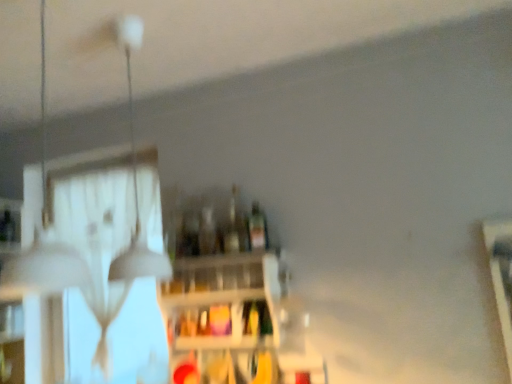
Question: In the image, is white matte lampshade at upper left, the first lamp viewed from the back, on the left side or the right side of translucent glass bottle at center, which appears as the 3th bottle when viewed from the right?

Choices:
 (A) left
 (B) right

Answer: (A)

Question: From the image's perspective, is white matte lampshade at upper left, the first lamp viewed from the back, located above or below translucent glass bottle at center, which appears as the 3th bottle when viewed from the right?

Choices:
 (A) above
 (B) below

Answer: (A)

Question: Which object is the farthest from the transparent glass door at upper left?

Choices:
 (A) white matte lampshade at upper left, which is the 2th lamp from front to back
 (B) matte yellow glass at center
 (C) translucent glass bottle at center, positioned as the 3th bottle in left-to-right order
 (D) wooden shelf at center
 (E) white matte lampshade at upper left, arranged as the 2th lamp when viewed from the back

Answer: (E)

Question: Based on their relative distances, which object is nearer to the white matte lampshade at upper left, the first lamp viewed from the back?

Choices:
 (A) wooden shelf at center
 (B) translucent glass bottle at center, which is counted as the first bottle, starting from the right
 (C) matte yellow glass at center
 (D) transparent glass door at upper left
 (E) white matte lampshade at upper left, which appears as the 1th lamp when viewed from the front

Answer: (D)